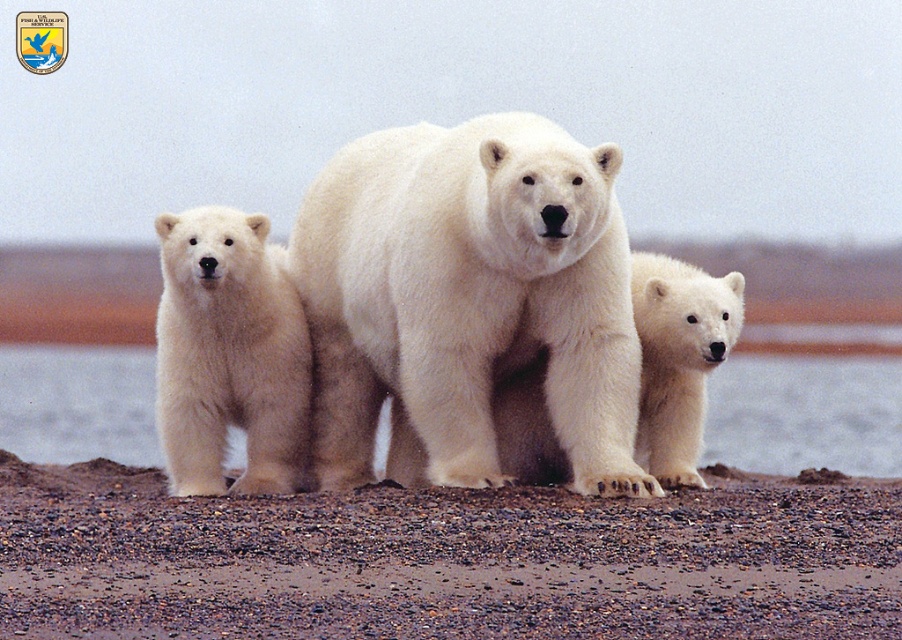
Question: Estimate the real-world distances between objects in this image. Which object is farther from the brown gravel at center?

Choices:
 (A) white fluffy bear cub at center
 (B) white fur water at center
 (C) white fluffy bear at left
 (D) white fur polar bear at center

Answer: (B)

Question: Does white fur water at center come behind white fluffy bear cub at center?

Choices:
 (A) yes
 (B) no

Answer: (A)

Question: Can you confirm if white fur polar bear at center is smaller than white fluffy bear at left?

Choices:
 (A) yes
 (B) no

Answer: (B)

Question: Which point appears farthest from the camera in this image?

Choices:
 (A) (565, 445)
 (B) (228, 461)
 (C) (168, 349)

Answer: (B)

Question: Does white fur water at center have a lesser width compared to white fluffy bear cub at center?

Choices:
 (A) no
 (B) yes

Answer: (A)

Question: Among these objects, which one is farthest from the camera?

Choices:
 (A) white fur water at center
 (B) brown gravel at center
 (C) white fluffy bear cub at center
 (D) white fur polar bear at center

Answer: (A)